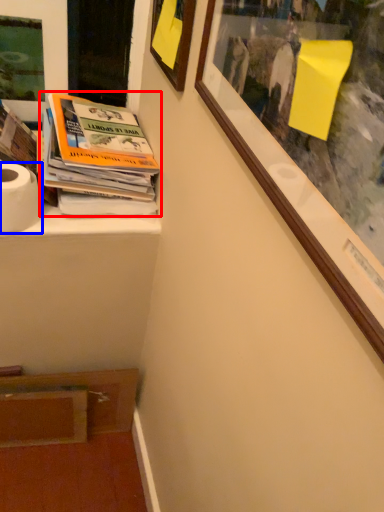
Question: Among these objects, which one is farthest to the camera, book (highlighted by a red box) or toilet paper (highlighted by a blue box)?

Choices:
 (A) book
 (B) toilet paper

Answer: (A)